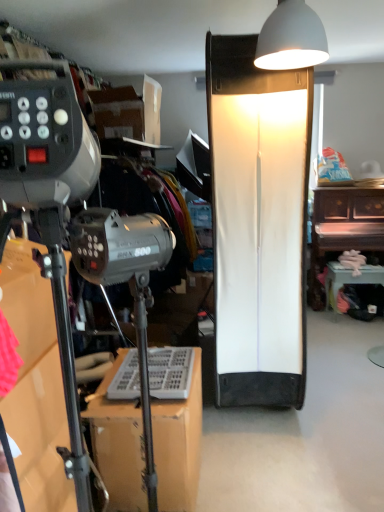
Question: From a real-world perspective, is white matte lampshade at upper center, placed as the first lamp when sorted from front to back, above or below wooden piano at right, placed as the third furniture when sorted from left to right?

Choices:
 (A) above
 (B) below

Answer: (A)

Question: From the image's perspective, is white matte lampshade at upper center, acting as the 1th lamp starting from the top, located above or below wooden piano at right, the first furniture in the back-to-front sequence?

Choices:
 (A) below
 (B) above

Answer: (B)

Question: Considering the real-world distances, which object is farthest from the metallic silver tripod at lower left, the 1th furniture in the left-to-right sequence?

Choices:
 (A) wooden piano at right, the first furniture in the right-to-left sequence
 (B) white matte lampshade at upper center, acting as the 1th lamp starting from the top
 (C) white glossy table at lower right, the second furniture in the back-to-front sequence
 (D) white matte lampshade at center, which is the second lamp from top to bottom

Answer: (A)

Question: Based on their relative distances, which object is farther from the wooden piano at right, which ranks as the 3th furniture in front-to-back order?

Choices:
 (A) white glossy table at lower right, the second furniture in the back-to-front sequence
 (B) metallic silver tripod at lower left, which is the 3th furniture from back to front
 (C) white matte lampshade at center, which is the second lamp from top to bottom
 (D) white matte lampshade at upper center, acting as the 1th lamp starting from the top

Answer: (B)